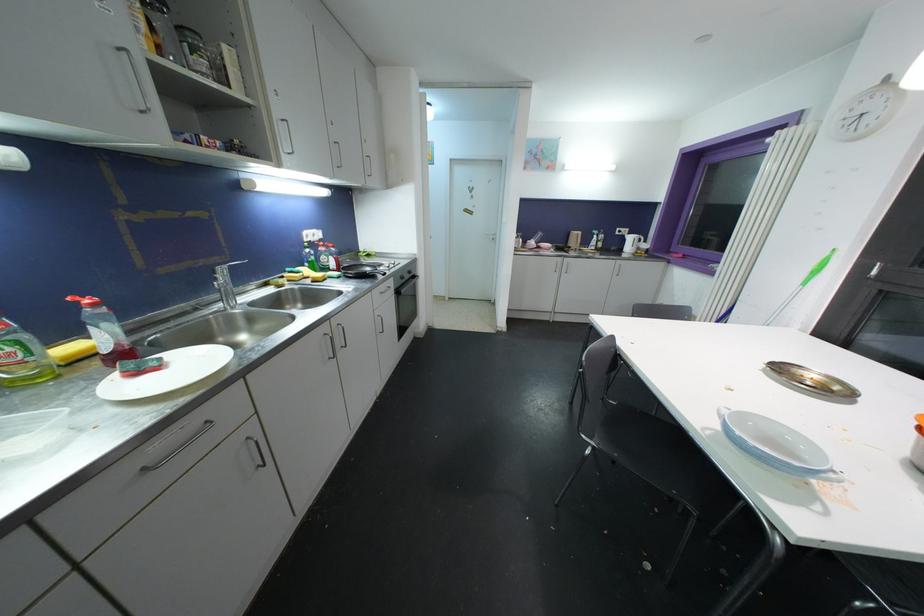
Where would you turn the white door handle? Please return your answer as a coordinate pair (x, y).

(488, 233)